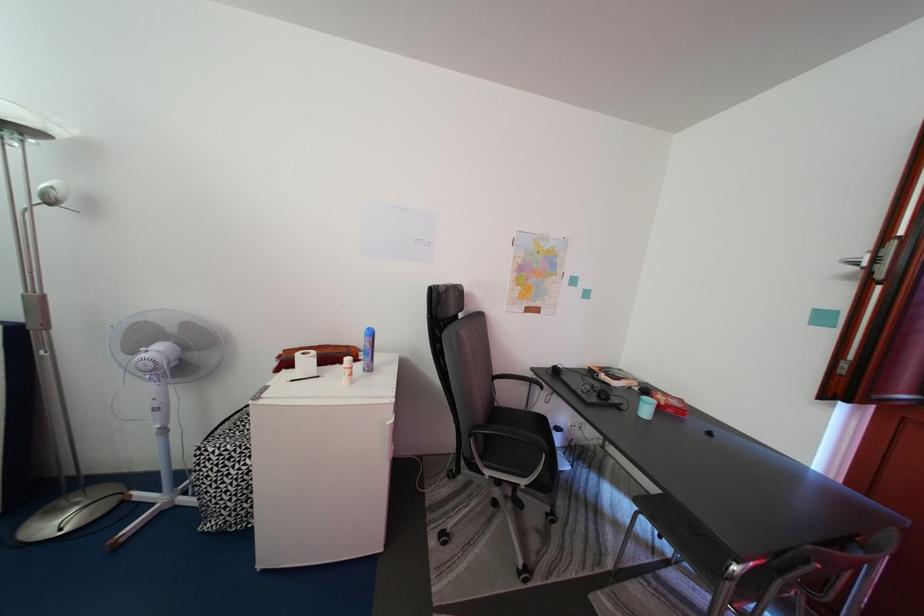
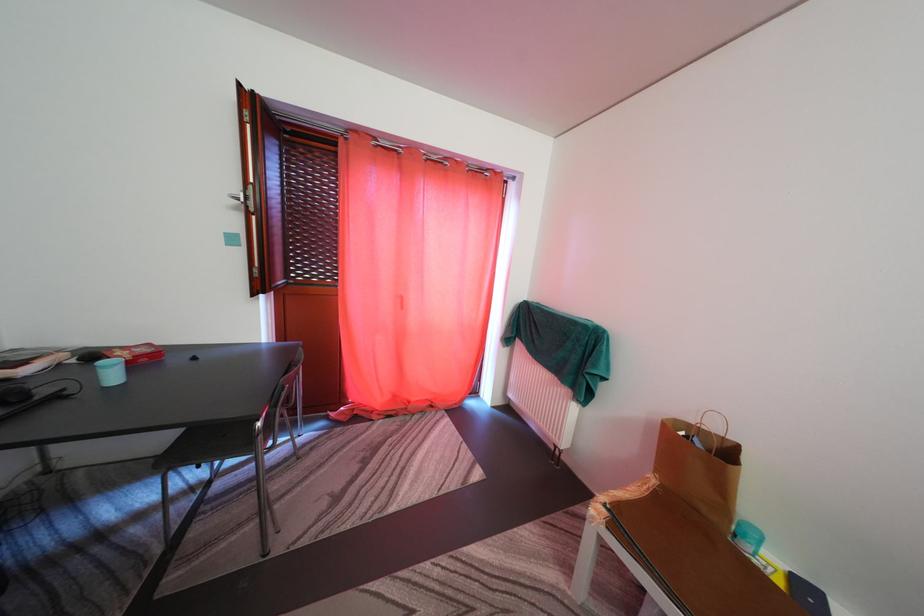
Locate, in the second image, the point that corresponds to the point at 669,403 in the first image.

(128, 360)